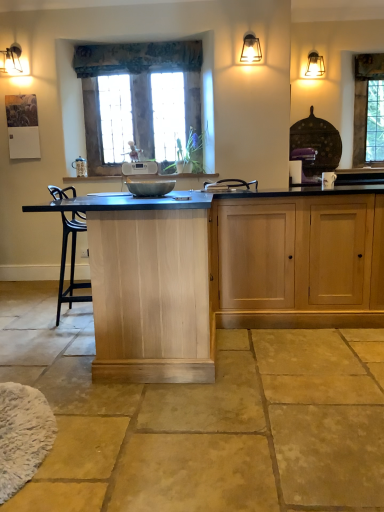
Find the location of `free spot behind white fluffy mat at lower left`. free spot behind white fluffy mat at lower left is located at coordinates (55, 373).